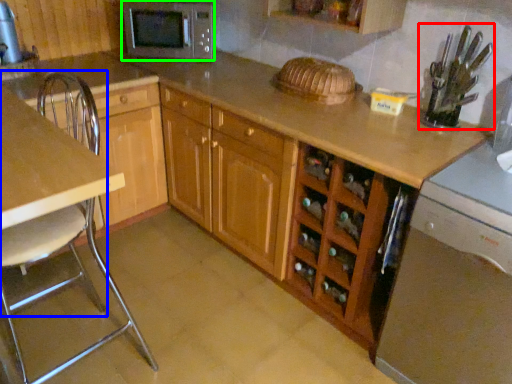
Question: Estimate the real-world distances between objects in this image. Which object is closer to appliance (highlighted by a red box), chair (highlighted by a blue box) or microwave oven (highlighted by a green box)?

Choices:
 (A) chair
 (B) microwave oven

Answer: (B)